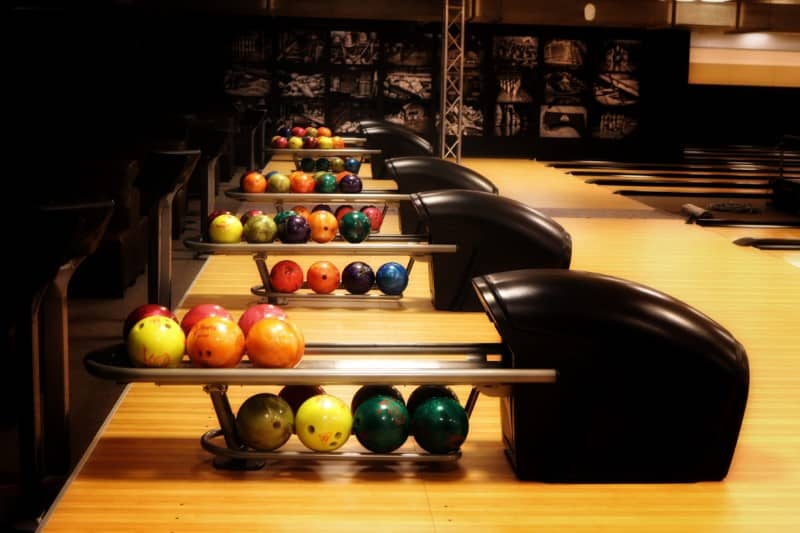
The height and width of the screenshot is (533, 800). Find the location of `lower ball storage racks`. lower ball storage racks is located at coordinates (365, 447), (336, 288), (378, 214), (352, 164).